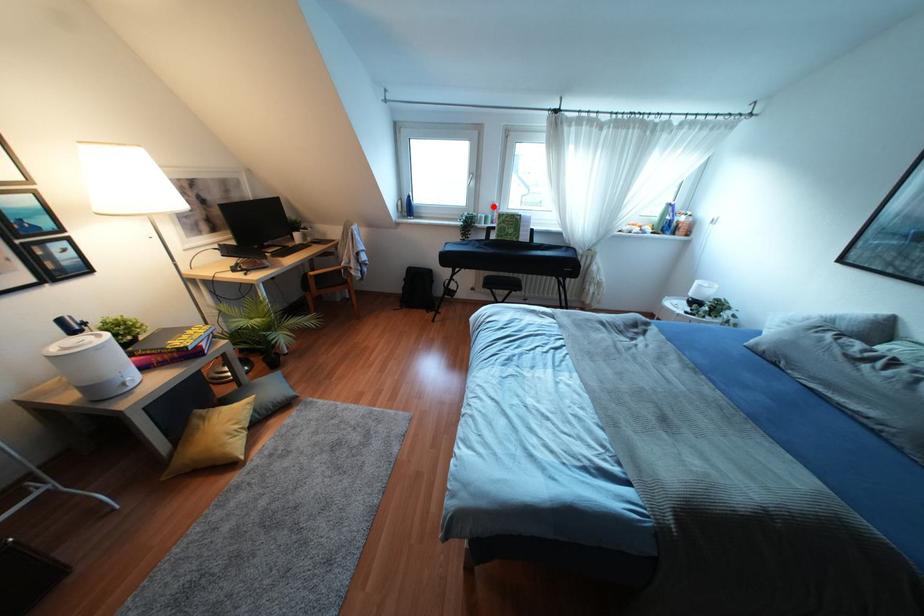
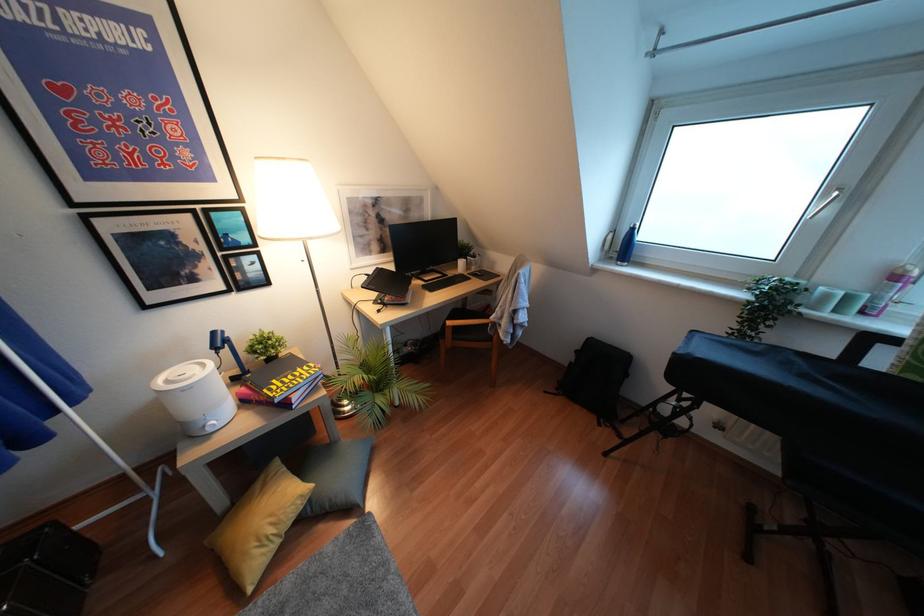
Question: I am providing you with two images of the same scene from different viewpoints. In image1, a red point is highlighted. Considering the same 3D point in image2, which of the following is correct?

Choices:
 (A) It is closer
 (B) It is farther

Answer: (B)